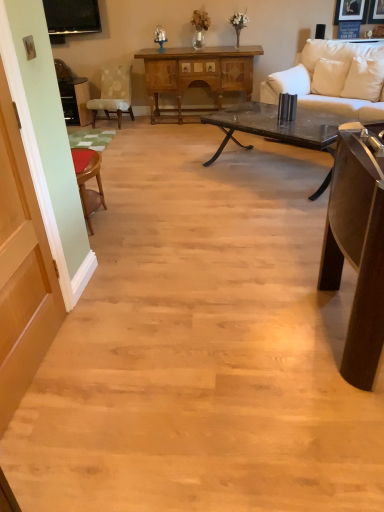
Locate an element on the screen. vacant space that is in between black glass coffee table at center and dark brown wood table at right, the 1th table when ordered from right to left is located at coordinates (269, 238).